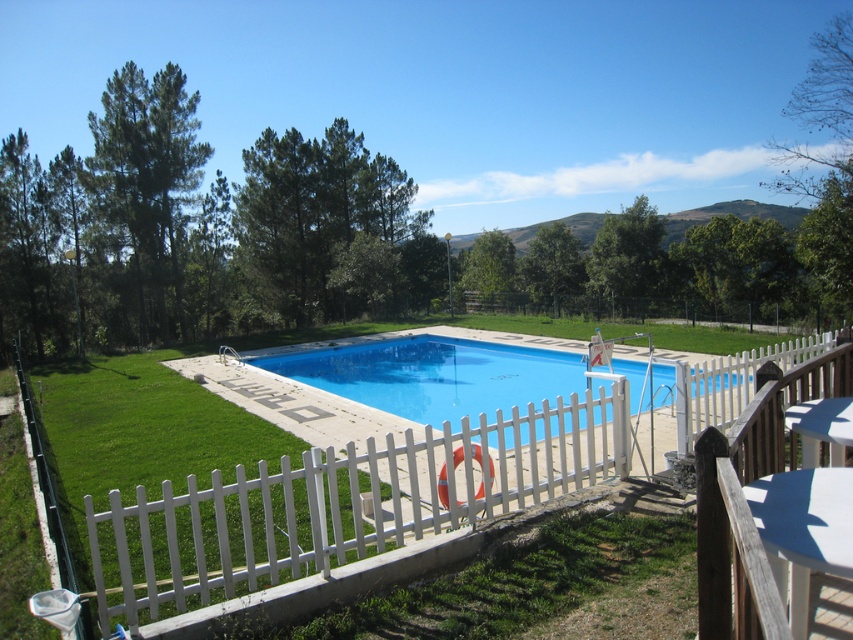
Does point (548, 480) lie in front of point (415, 378)?

Yes, point (548, 480) is closer to viewer.

Which of these two, white picket fence at center or blue smooth pool at center, stands shorter?

white picket fence at center

Between point (352, 540) and point (524, 396), which one is positioned in front?

Point (352, 540) is more forward.

The image size is (853, 640). Identify the location of white picket fence at center. (349, 500).